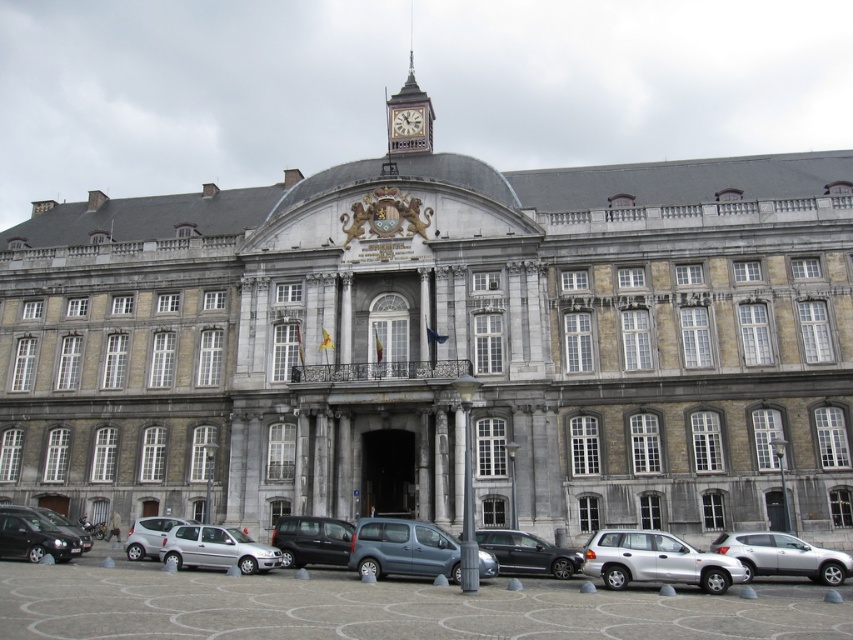
You are a pedestrian standing in front of the grand historical building. You see a silver metallic car at lower right and a matte black van at center. Which vehicle is positioned higher in the image?

The silver metallic car at lower right is located above the matte black van at center, so it is positioned higher in the image.

You are a pedestrian standing at the entrance of the grand historical building and see two cars, the matte black car at lower left and the silver metallic hatchback at lower left. Which car is closer to you?

The matte black car at lower left is closer to you because it is in front of the silver metallic hatchback at lower left.

Looking at this image, you are standing at the entrance of the grand historical building and want to park your car. The parking spot you need is located at coordinate point 0.869, 0.919. Is the silver metallic car at lower right currently occupying that spot?

The silver metallic car at lower right is located at point (782, 556), so yes, it is occupying the parking spot at that coordinate.